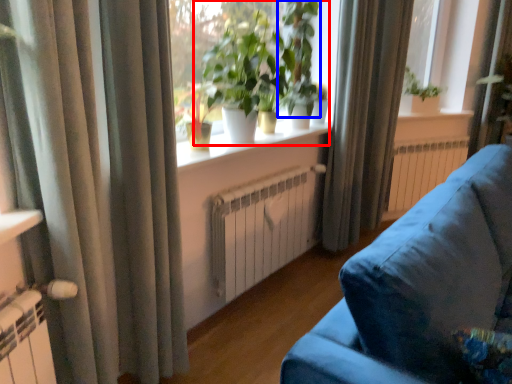
Question: Which point is further to the camera, houseplant (highlighted by a red box) or vegetation (highlighted by a blue box)?

Choices:
 (A) houseplant
 (B) vegetation

Answer: (B)